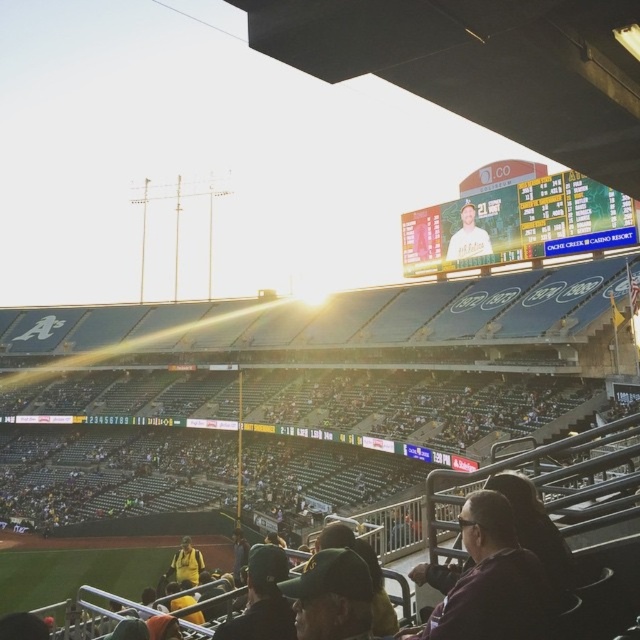
Looking at this image, does purple fabric jacket at lower right have a smaller size compared to white matte shirt at upper center?

Yes, purple fabric jacket at lower right is smaller than white matte shirt at upper center.

Which is behind, point (512, 627) or point (448, 248)?

Positioned behind is point (448, 248).

This screenshot has width=640, height=640. What are the coordinates of `purple fabric jacket at lower right` in the screenshot? It's located at (492, 580).

Is green plastic scoreboard at upper center wider than yellow jersey at lower center?

Yes, green plastic scoreboard at upper center is wider than yellow jersey at lower center.

Does point (474, 209) come closer to viewer compared to point (193, 582)?

No.

Does point (552, 256) lie in front of point (196, 557)?

That is False.

Locate an element on the screen. green plastic scoreboard at upper center is located at coordinates (516, 225).

Which of these two, green plastic scoreboard at upper center or purple fabric jacket at lower right, stands shorter?

Standing shorter between the two is purple fabric jacket at lower right.

Can you confirm if green plastic scoreboard at upper center is positioned above purple fabric jacket at lower right?

Indeed, green plastic scoreboard at upper center is positioned over purple fabric jacket at lower right.

Which is in front, point (472, 211) or point (474, 493)?

Point (474, 493) is in front.

Where is `green plastic scoreboard at upper center`? This screenshot has width=640, height=640. green plastic scoreboard at upper center is located at coordinates (516, 225).